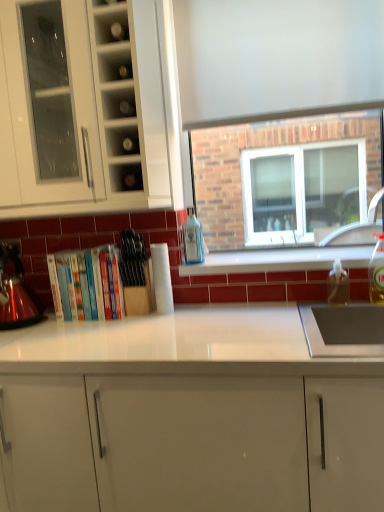
Find the location of a particular element. This screenshot has height=512, width=384. free location above white glossy window sill at center (from a real-world perspective) is located at coordinates (274, 257).